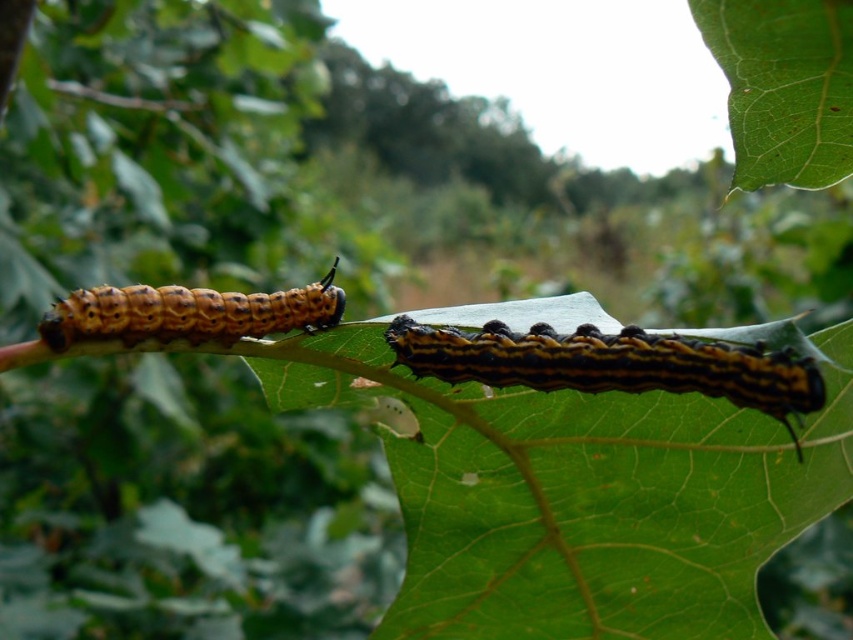
Can you confirm if brown fuzzy caterpillar at center is taller than brown fuzzy caterpillar at left?

Indeed, brown fuzzy caterpillar at center has a greater height compared to brown fuzzy caterpillar at left.

Locate an element on the screen. The width and height of the screenshot is (853, 640). brown fuzzy caterpillar at center is located at coordinates (613, 364).

Where is `brown fuzzy caterpillar at center`? The width and height of the screenshot is (853, 640). brown fuzzy caterpillar at center is located at coordinates (613, 364).